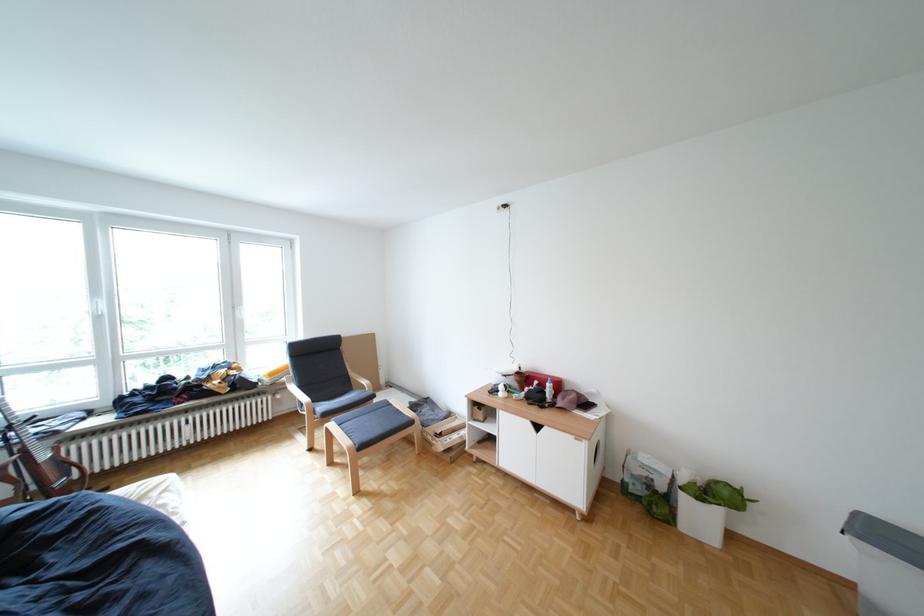
Describe the element at coordinates (372, 424) in the screenshot. This screenshot has width=924, height=616. I see `the dark gray footstool surface` at that location.